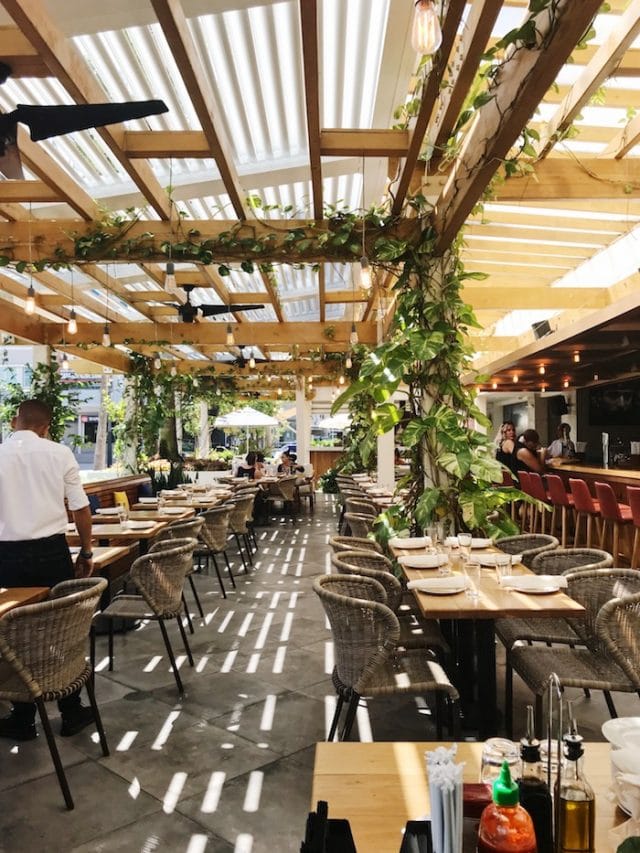
The image size is (640, 853). Identify the location of floor. (253, 712).